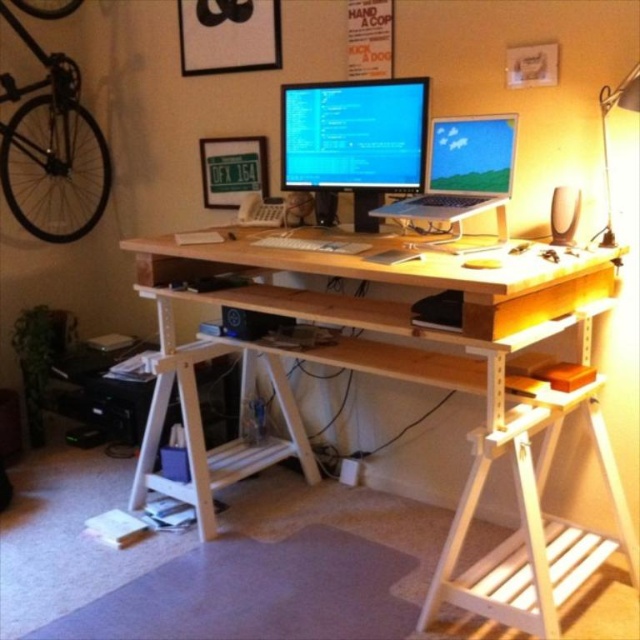
What are the coordinates of the matte black monitor at center?

The coordinates of the matte black monitor at center are 0.212 in the x direction and 0.555 in the y direction.

You are setting up a new mouse for your home office. The mouse requires a 15 inch workspace to function properly. Given the distance between the matte black monitor at center and the white matte keyboard at center, will the mouse have enough space to operate?

The distance between the matte black monitor at center and the white matte keyboard at center is 14.42 inches, which is less than the required 15 inches. Therefore, the mouse may not have enough space to operate properly.

From the picture: You are setting up a new monitor stand on your desk and need to ensure there is enough vertical space between the metallic silver desk lamp at upper right and the white matte keyboard at center. Can the monitor stand, which is 15 cm tall, fit between them?

The metallic silver desk lamp at upper right is taller than the white matte keyboard at center. Since the monitor stand is 15 cm tall, it can fit between them as long as the vertical space between the two objects is at least 15 cm. However, the exact height difference isn